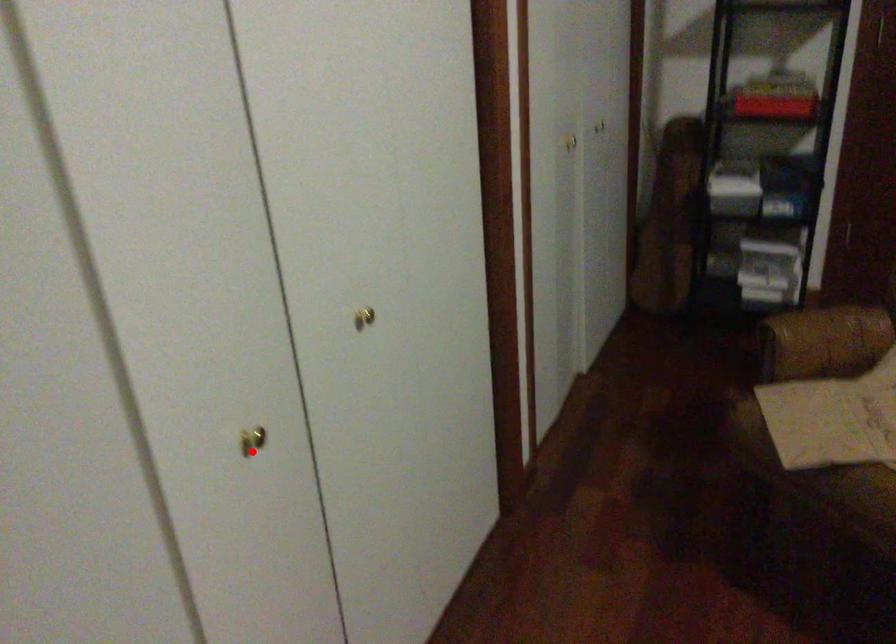
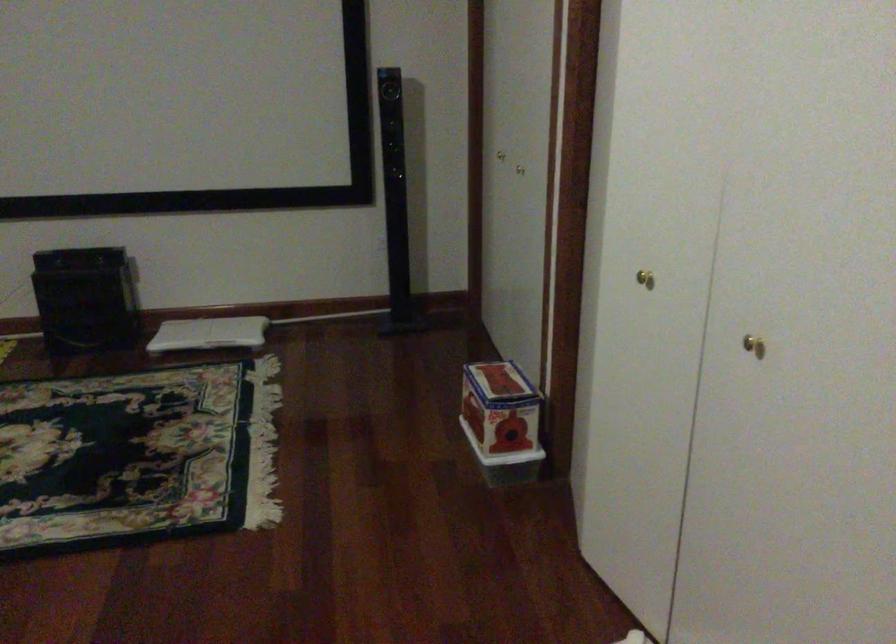
Question: A red point is marked in image1. In image2, is the corresponding 3D point closer to the camera or farther? Reply with the corresponding letter.

Choices:
 (A) The corresponding 3D point is closer.
 (B) The corresponding 3D point is farther.

Answer: (B)